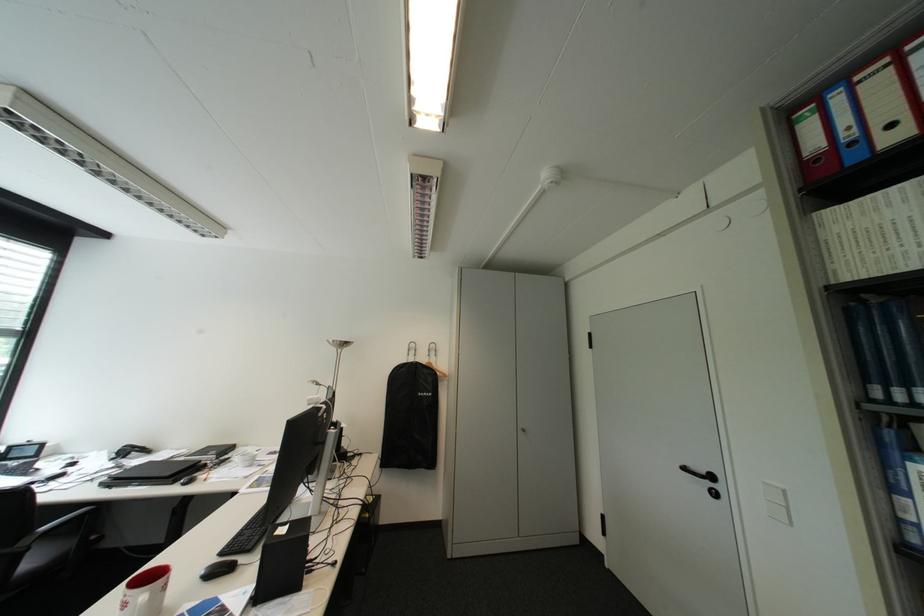
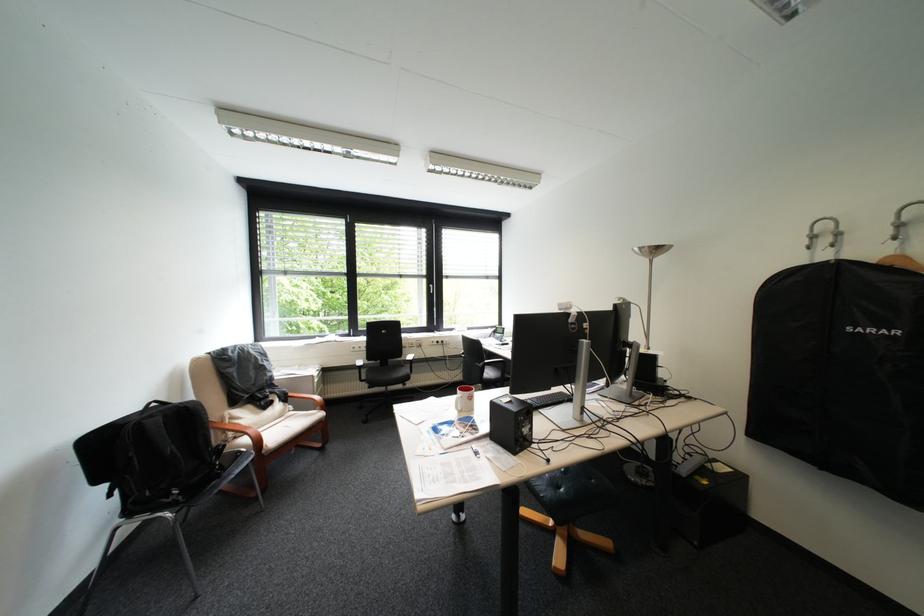
The point at (436, 363) is marked in the first image. Where is the corresponding point in the second image?

(886, 262)